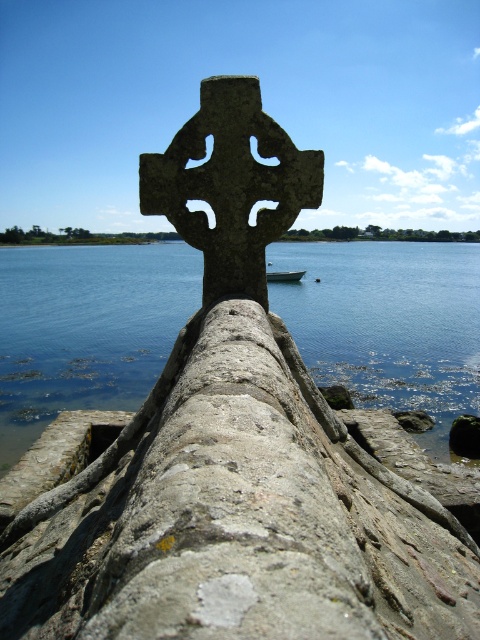
You are a photographer planning to capture the blue water at center and the white matte boat at center in a single shot. Based on their positions, which object should you focus on first to ensure both are in frame?

The blue water at center is positioned over the white matte boat at center, so you should focus on the white matte boat at center first to ensure both are in frame.

You are a photographer planning to capture the blue water at center and the white matte boat at center in a single frame. Based on their sizes, which object should you focus on to ensure both are clearly visible without zooming in or out?

The blue water at center has a larger width than the white matte boat at center, so focusing on the blue water at center would allow both objects to be clearly visible without needing to adjust the zoom.

You are standing in front of the stone Celtic cross and want to find the blue water at center. According to the coordinates provided, in which direction should you look relative to the cross?

The blue water at center is located at coordinates point (387, 323). Since the cross is off to the left, you should look towards the right side of the cross to find the blue water at center.